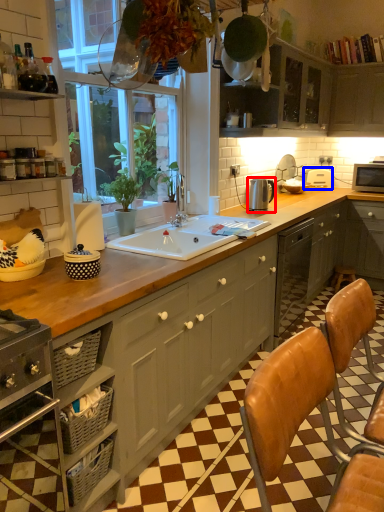
Question: Among these objects, which one is nearest to the camera, appliance (highlighted by a red box) or appliance (highlighted by a blue box)?

Choices:
 (A) appliance
 (B) appliance

Answer: (A)